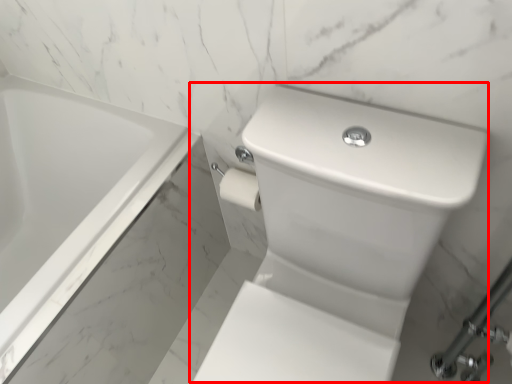
Question: From the image's perspective, what is the correct spatial relationship of sink (annotated by the red box) in relation to bathtub?

Choices:
 (A) below
 (B) above

Answer: (A)